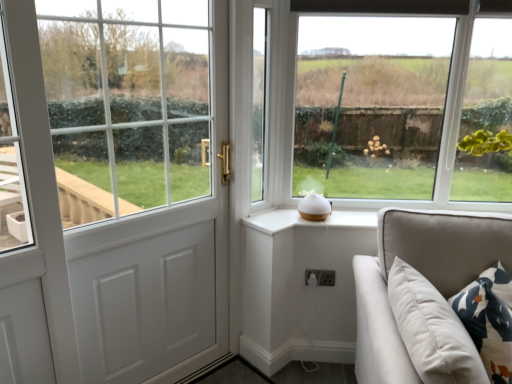
Question: From a real-world perspective, does white glass door at left, arranged as the 1th window when viewed from the left, sit lower than white plastic electric outlet at lower center?

Choices:
 (A) yes
 (B) no

Answer: (B)

Question: Considering the relative sizes of white glass door at left, arranged as the 1th window when viewed from the left, and white plastic electric outlet at lower center in the image provided, is white glass door at left, arranged as the 1th window when viewed from the left, bigger than white plastic electric outlet at lower center?

Choices:
 (A) no
 (B) yes

Answer: (B)

Question: From the image's perspective, is white glass door at left, the third window when ordered from right to left, on top of white plastic electric outlet at lower center?

Choices:
 (A) yes
 (B) no

Answer: (A)

Question: Can you confirm if white glass door at left, the third window when ordered from right to left, is positioned to the left of white plastic electric outlet at lower center?

Choices:
 (A) yes
 (B) no

Answer: (A)

Question: Is the surface of white glass door at left, the third window when ordered from right to left, in direct contact with white plastic electric outlet at lower center?

Choices:
 (A) no
 (B) yes

Answer: (A)

Question: Visually, is white plastic electric outlet at lower center positioned to the left or to the right of white glass door at left, the third window when ordered from right to left?

Choices:
 (A) left
 (B) right

Answer: (B)

Question: Which is correct: white plastic electric outlet at lower center is inside white glass door at left, arranged as the 1th window when viewed from the left, or outside of it?

Choices:
 (A) outside
 (B) inside

Answer: (A)

Question: Considering the positions of white plastic electric outlet at lower center and white glass door at left, the third window when ordered from right to left, in the image, is white plastic electric outlet at lower center bigger or smaller than white glass door at left, the third window when ordered from right to left,?

Choices:
 (A) big
 (B) small

Answer: (B)

Question: From a real-world perspective, is white plastic electric outlet at lower center positioned above or below white glass door at left, arranged as the 1th window when viewed from the left?

Choices:
 (A) below
 (B) above

Answer: (A)

Question: Based on their sizes in the image, would you say white glass door at left, arranged as the 1th window when viewed from the left, is bigger or smaller than beige fabric couch at lower right?

Choices:
 (A) big
 (B) small

Answer: (A)

Question: Relative to beige fabric couch at lower right, is white glass door at left, the third window when ordered from right to left, in front or behind?

Choices:
 (A) behind
 (B) front

Answer: (A)

Question: Visually, is white glass door at left, the third window when ordered from right to left, positioned to the left or to the right of beige fabric couch at lower right?

Choices:
 (A) left
 (B) right

Answer: (A)

Question: From their relative heights in the image, would you say white glass door at left, the third window when ordered from right to left, is taller or shorter than beige fabric couch at lower right?

Choices:
 (A) tall
 (B) short

Answer: (A)

Question: Is white glass window at center, the 2th window viewed from the left, in front of or behind beige fabric couch at lower right in the image?

Choices:
 (A) behind
 (B) front

Answer: (A)

Question: Looking at the image, does white glass window at center, the 2th window viewed from the left, seem bigger or smaller compared to beige fabric couch at lower right?

Choices:
 (A) big
 (B) small

Answer: (B)